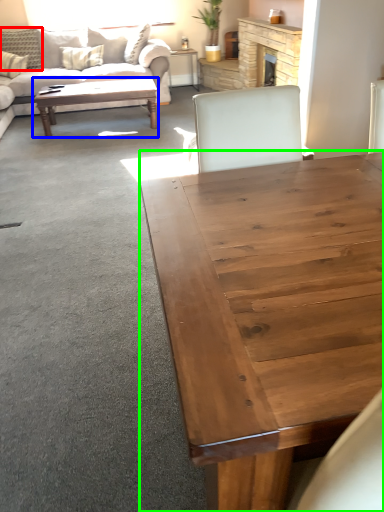
Question: Considering the real-world distances, which object is farthest from pillow (highlighted by a red box)? coffee table (highlighted by a blue box) or coffee table (highlighted by a green box)?

Choices:
 (A) coffee table
 (B) coffee table

Answer: (B)